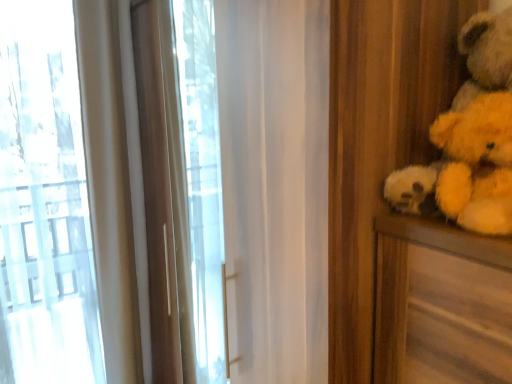
Question: Can you confirm if yellow plush teddy bear at right is bigger than yellow plush bear at right?

Choices:
 (A) no
 (B) yes

Answer: (B)

Question: Can you confirm if yellow plush teddy bear at right is positioned to the left of yellow plush bear at right?

Choices:
 (A) yes
 (B) no

Answer: (B)

Question: Is yellow plush teddy bear at right not near yellow plush bear at right?

Choices:
 (A) yes
 (B) no

Answer: (B)

Question: Is yellow plush teddy bear at right to the right of yellow plush bear at right from the viewer's perspective?

Choices:
 (A) yes
 (B) no

Answer: (A)

Question: From a real-world perspective, is yellow plush teddy bear at right positioned under yellow plush bear at right based on gravity?

Choices:
 (A) no
 (B) yes

Answer: (A)

Question: Does yellow plush teddy bear at right come in front of yellow plush bear at right?

Choices:
 (A) no
 (B) yes

Answer: (A)

Question: Is yellow plush bear at right placed right next to yellow plush teddy bear at right?

Choices:
 (A) yes
 (B) no

Answer: (A)

Question: Is yellow plush bear at right located outside yellow plush teddy bear at right?

Choices:
 (A) no
 (B) yes

Answer: (A)

Question: Considering the relative sizes of yellow plush bear at right and yellow plush teddy bear at right in the image provided, is yellow plush bear at right thinner than yellow plush teddy bear at right?

Choices:
 (A) no
 (B) yes

Answer: (B)

Question: Does yellow plush bear at right have a smaller size compared to yellow plush teddy bear at right?

Choices:
 (A) no
 (B) yes

Answer: (B)

Question: From the image's perspective, is yellow plush bear at right below yellow plush teddy bear at right?

Choices:
 (A) no
 (B) yes

Answer: (B)

Question: From the image's perspective, is yellow plush bear at right above yellow plush teddy bear at right?

Choices:
 (A) no
 (B) yes

Answer: (A)

Question: Looking at their shapes, would you say yellow plush bear at right is wider or thinner than yellow plush teddy bear at right?

Choices:
 (A) thin
 (B) wide

Answer: (A)